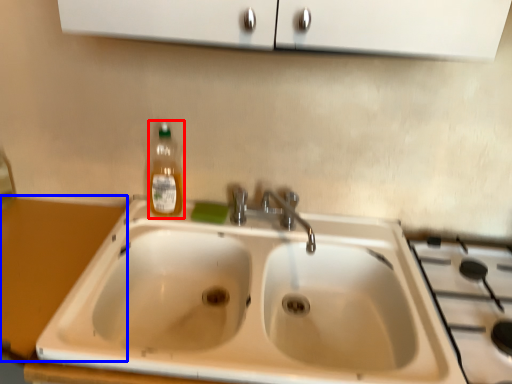
Question: Among these objects, which one is farthest to the camera, bottle (highlighted by a red box) or counter top (highlighted by a blue box)?

Choices:
 (A) bottle
 (B) counter top

Answer: (A)